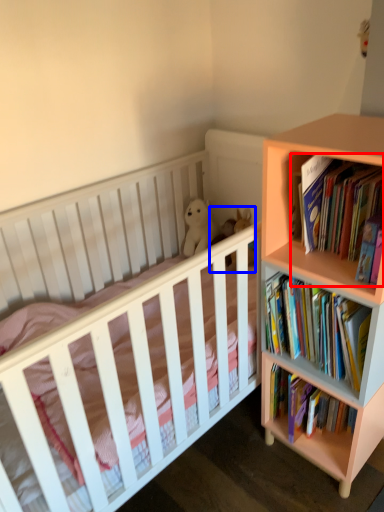
Question: Which point is closer to the camera, book (highlighted by a red box) or toy (highlighted by a blue box)?

Choices:
 (A) book
 (B) toy

Answer: (A)